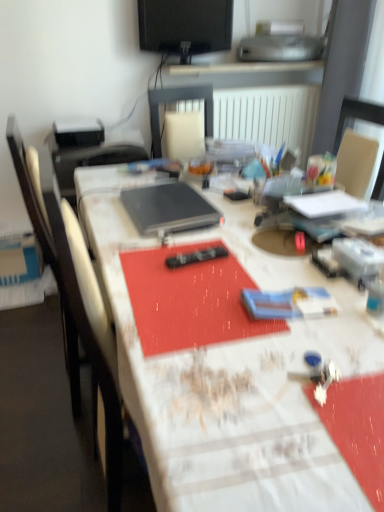
Where is `free location in front of black plastic remote control at center`? free location in front of black plastic remote control at center is located at coordinates (193, 291).